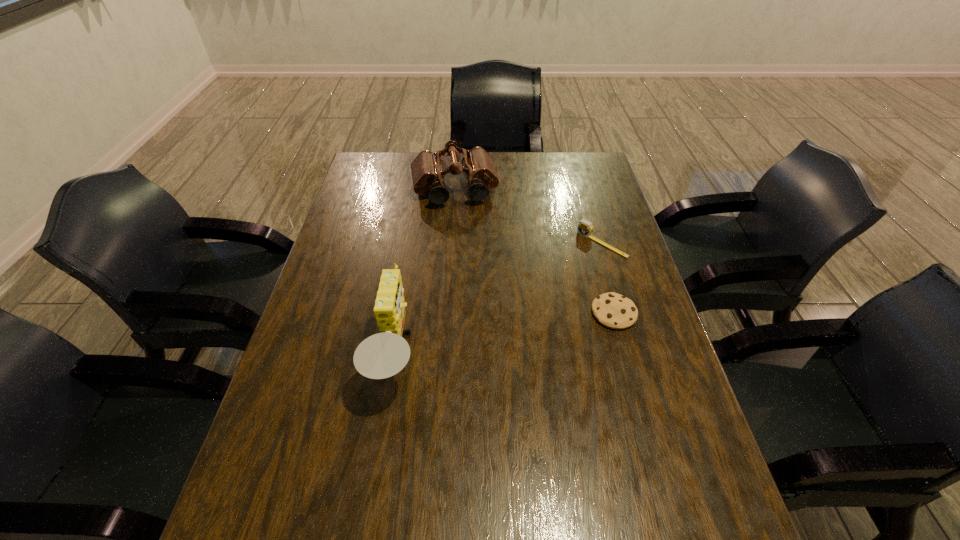
Locate an element on the screen. free space on the desktop that is between the sponge and the shortest object and is positioned through the eyepieces of the third shortest object is located at coordinates (481, 339).

Locate an element on the screen. Image resolution: width=960 pixels, height=540 pixels. free space on the desktop that is between the sponge and the cookie and is positioned at the front of the second farthest object with the tape extended is located at coordinates (490, 338).